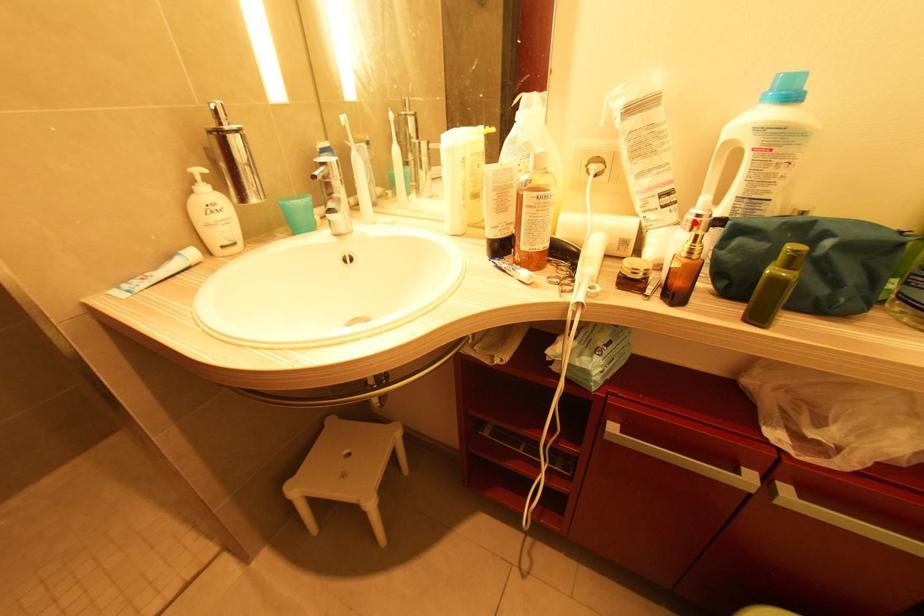
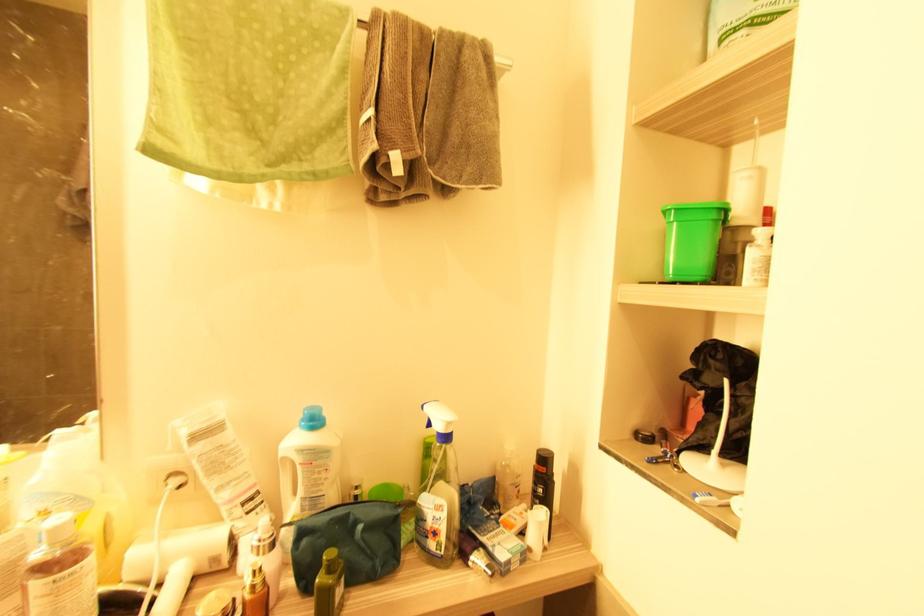
Find the pixel in the second image that matches the highlighted location in the first image.

(261, 546)